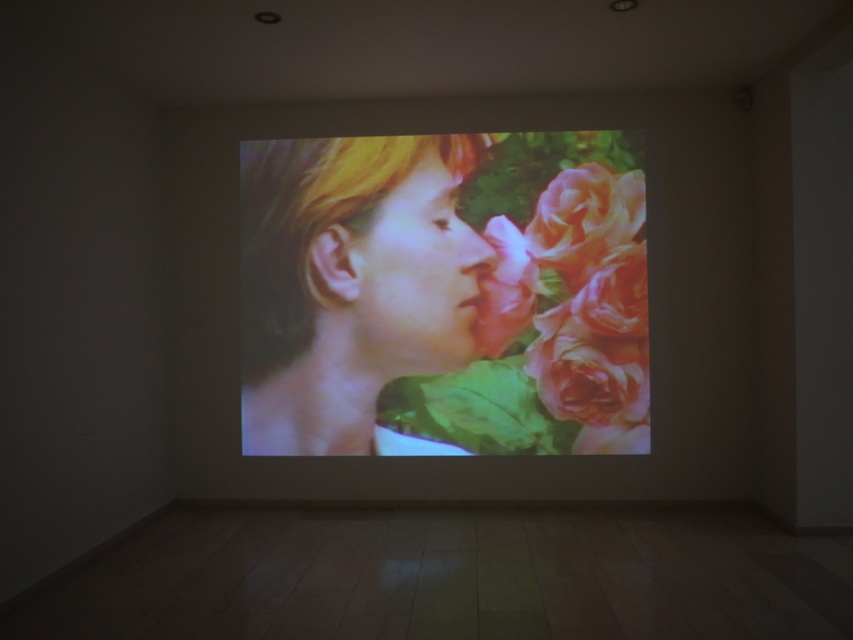
Between pink matte rose at center and pink silky rose at center, which one appears on the right side from the viewer's perspective?

pink silky rose at center

Does pink matte rose at center have a greater height compared to pink silky rose at center?

Yes.

At what (x,y) coordinates should I click in order to perform the action: click on pink matte rose at center. Please return your answer as a coordinate pair (x, y). This screenshot has width=853, height=640. Looking at the image, I should click on (579, 304).

This screenshot has height=640, width=853. In order to click on pink matte rose at center in this screenshot , I will do `click(579, 304)`.

Is smooth skin face at center further to camera compared to pink matte rose at center?

Yes, smooth skin face at center is behind pink matte rose at center.

Who is positioned more to the right, smooth skin face at center or pink matte rose at center?

pink matte rose at center is more to the right.

What do you see at coordinates (350, 282) in the screenshot? The width and height of the screenshot is (853, 640). I see `smooth skin face at center` at bounding box center [350, 282].

At what (x,y) coordinates should I click in order to perform the action: click on smooth skin face at center. Please return your answer as a coordinate pair (x, y). This screenshot has height=640, width=853. Looking at the image, I should click on (350, 282).

Does point (376, 168) come behind point (560, 237)?

Yes, it is.

Which is more to the right, smooth skin face at center or pink silky rose at center?

From the viewer's perspective, pink silky rose at center appears more on the right side.

Who is more distant from viewer, (409, 150) or (532, 220)?

Positioned behind is point (409, 150).

At what (x,y) coordinates should I click in order to perform the action: click on smooth skin face at center. Please return your answer as a coordinate pair (x, y). The width and height of the screenshot is (853, 640). Looking at the image, I should click on (350, 282).